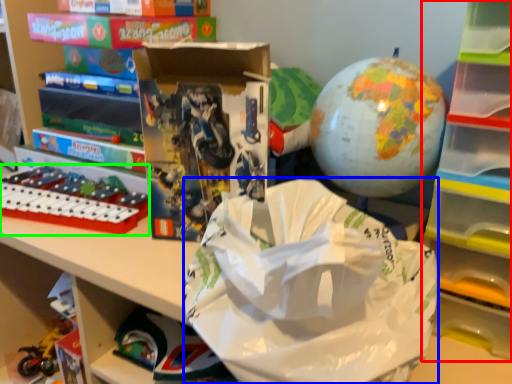
Question: Which object is the farthest from bookshelf (highlighted by a red box)? Choose among these: grocery bag (highlighted by a blue box) or toy (highlighted by a green box).

Choices:
 (A) grocery bag
 (B) toy

Answer: (B)